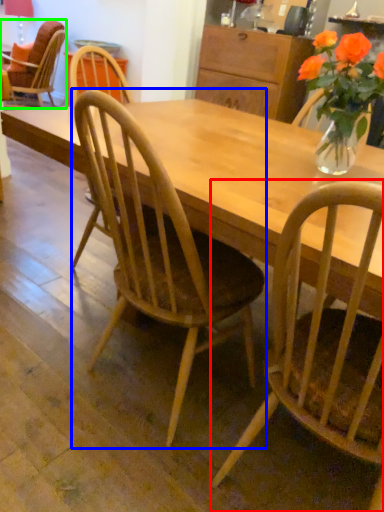
Question: Which is farther away from chair (highlighted by a red box)? chair (highlighted by a blue box) or chair (highlighted by a green box)?

Choices:
 (A) chair
 (B) chair

Answer: (B)